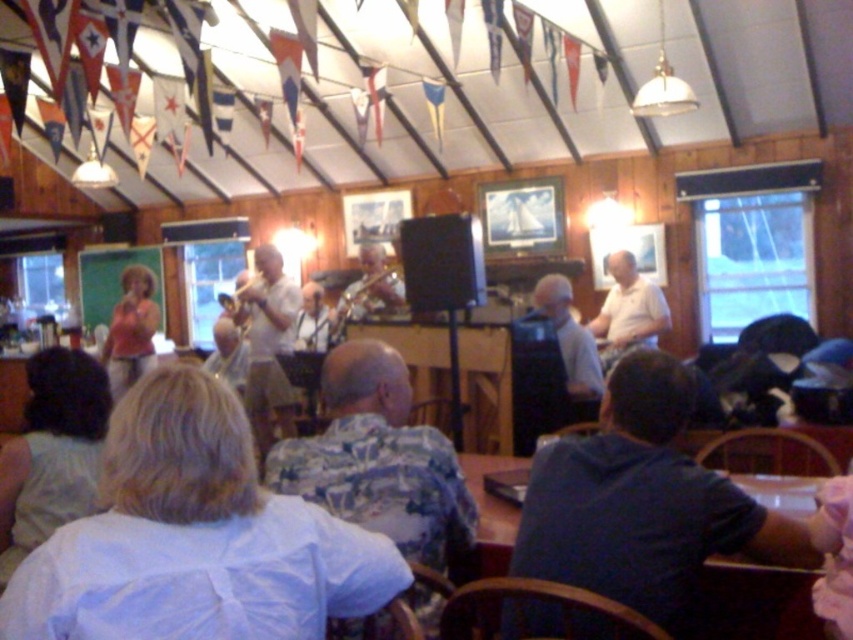
The height and width of the screenshot is (640, 853). What do you see at coordinates (268, 344) in the screenshot?
I see `white matte shirt at center` at bounding box center [268, 344].

Does white matte shirt at center have a greater width compared to matte pink blouse at left?

Indeed, white matte shirt at center has a greater width compared to matte pink blouse at left.

Between point (250, 381) and point (132, 282), which one is positioned in front?

Point (250, 381) is in front.

This screenshot has width=853, height=640. What are the coordinates of `white matte shirt at center` in the screenshot? It's located at (268, 344).

Is point (677, 497) positioned in front of point (282, 284)?

Yes, point (677, 497) is closer to viewer.

Who is positioned more to the right, dark blue shirt at lower right or white matte shirt at center?

dark blue shirt at lower right

Does point (752, 515) lie in front of point (256, 262)?

Yes, it is in front of point (256, 262).

Identify the location of dark blue shirt at lower right. (642, 502).

Does light blue cotton shirt at center have a lesser width compared to dark blue shirt at lower right?

Indeed, light blue cotton shirt at center has a lesser width compared to dark blue shirt at lower right.

In the scene shown: Can you confirm if light blue cotton shirt at center is smaller than dark blue shirt at lower right?

Yes, light blue cotton shirt at center is smaller than dark blue shirt at lower right.

Between point (103, 492) and point (674, 417), which one is positioned in front?

Positioned in front is point (103, 492).

Locate an element on the screen. This screenshot has width=853, height=640. light blue cotton shirt at center is located at coordinates (x=195, y=538).